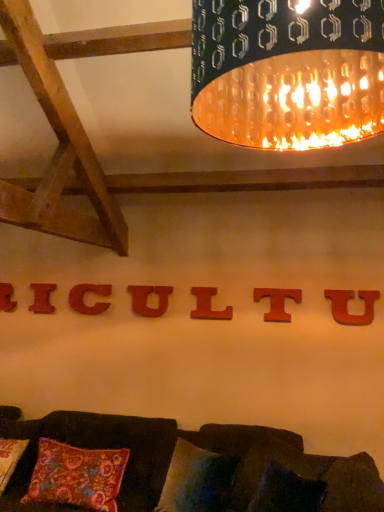
Question: Does point (193, 312) appear closer or farther from the camera than point (44, 311)?

Choices:
 (A) closer
 (B) farther

Answer: (A)

Question: Would you say wooden letter l at center, placed as the third alphabet when sorted from right to left, is to the left or to the right of red wood letter i at center, the 6th alphabet viewed from the right, in the picture?

Choices:
 (A) right
 (B) left

Answer: (A)

Question: Estimate the real-world distances between objects in this image. Which object is closer to the metallic textured lampshade at upper center?

Choices:
 (A) red matte letter c at center, which appears as the third alphabet when viewed from the left
 (B) matte wood letter u at center, which ranks as the 7th alphabet in left-to-right order
 (C) wooden letter l at center, which is the fifth alphabet in left-to-right order
 (D) wooden letter t at center, acting as the second alphabet starting from the right
 (E) multicolored fabric pillow at lower center, the second pillow when ordered from right to left

Answer: (D)

Question: Based on their relative distances, which object is nearer to the floral fabric pillow at lower center, which appears as the first pillow when viewed from the right?

Choices:
 (A) red wood letter i at center, placed as the 2th alphabet when sorted from left to right
 (B) velvety floral pillow at lower left, the 3th pillow viewed from the right
 (C) metallic textured lampshade at upper center
 (D) wooden letter at center, arranged as the first alphabet when viewed from the left
 (E) velvet dark brown couch at lower center

Answer: (E)